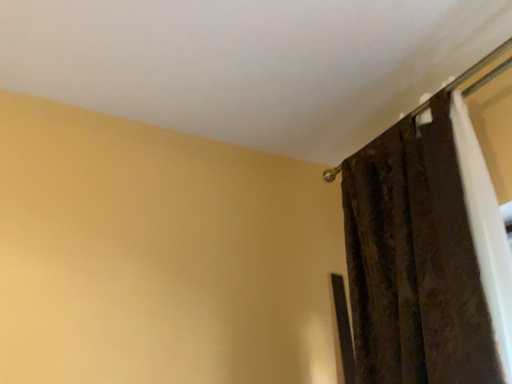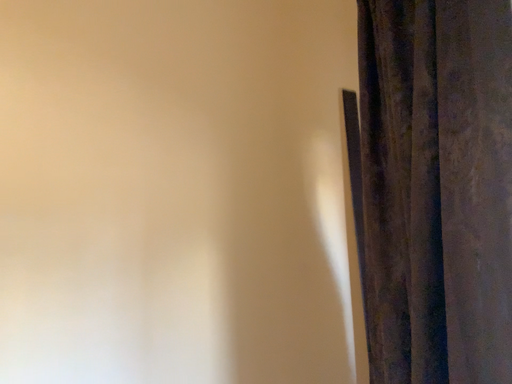
Question: Which way did the camera rotate in the video?

Choices:
 (A) rotated downward
 (B) rotated upward

Answer: (A)